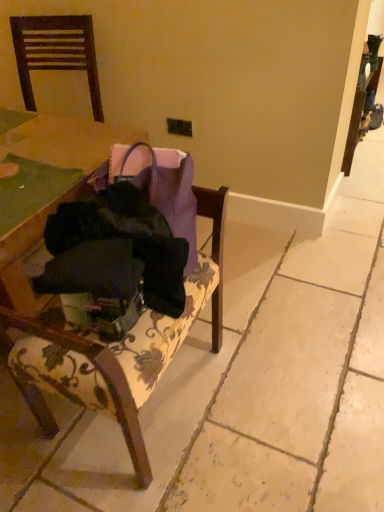
Question: Does velvet floral-patterned chair at center, which is counted as the 1th chair, starting from the right, have a lesser height compared to dark wood chair at upper left, which appears as the second chair when ordered from the bottom?

Choices:
 (A) yes
 (B) no

Answer: (B)

Question: From a real-world perspective, is velvet floral-patterned chair at center, the 1th chair from the bottom, located higher than dark wood chair at upper left, positioned as the 1th chair in left-to-right order?

Choices:
 (A) yes
 (B) no

Answer: (B)

Question: From the image's perspective, would you say velvet floral-patterned chair at center, the 1th chair from the bottom, is positioned over dark wood chair at upper left, which appears as the first chair when viewed from the top?

Choices:
 (A) yes
 (B) no

Answer: (B)

Question: Is velvet floral-patterned chair at center, acting as the 2th chair starting from the left, to the right of dark wood chair at upper left, acting as the 2th chair starting from the right, from the viewer's perspective?

Choices:
 (A) yes
 (B) no

Answer: (A)

Question: Does velvet floral-patterned chair at center, which is counted as the 1th chair, starting from the right, appear on the left side of dark wood chair at upper left, which appears as the first chair when viewed from the top?

Choices:
 (A) no
 (B) yes

Answer: (A)

Question: Is velvet floral-patterned chair at center, the 1th chair from the bottom, wider than dark wood chair at upper left, which appears as the first chair when viewed from the top?

Choices:
 (A) yes
 (B) no

Answer: (B)

Question: Can you confirm if velvet floral-patterned chair at center, which appears as the 2th chair when viewed from the top, is shorter than black fabric bag at center?

Choices:
 (A) yes
 (B) no

Answer: (B)

Question: Is velvet floral-patterned chair at center, acting as the 2th chair starting from the left, to the left of black fabric bag at center from the viewer's perspective?

Choices:
 (A) no
 (B) yes

Answer: (B)

Question: From a real-world perspective, is velvet floral-patterned chair at center, acting as the 2th chair starting from the left, physically above black fabric bag at center?

Choices:
 (A) no
 (B) yes

Answer: (A)

Question: Is velvet floral-patterned chair at center, acting as the 2th chair starting from the left, far away from black fabric bag at center?

Choices:
 (A) no
 (B) yes

Answer: (A)

Question: Does velvet floral-patterned chair at center, which is counted as the 1th chair, starting from the right, appear on the right side of black fabric bag at center?

Choices:
 (A) no
 (B) yes

Answer: (A)

Question: Is velvet floral-patterned chair at center, which appears as the 2th chair when viewed from the top, positioned in front of black fabric bag at center?

Choices:
 (A) no
 (B) yes

Answer: (B)

Question: From the image's perspective, is dark wood chair at upper left, which appears as the second chair when ordered from the bottom, beneath velvet floral-patterned chair at center, which is counted as the 1th chair, starting from the right?

Choices:
 (A) no
 (B) yes

Answer: (A)